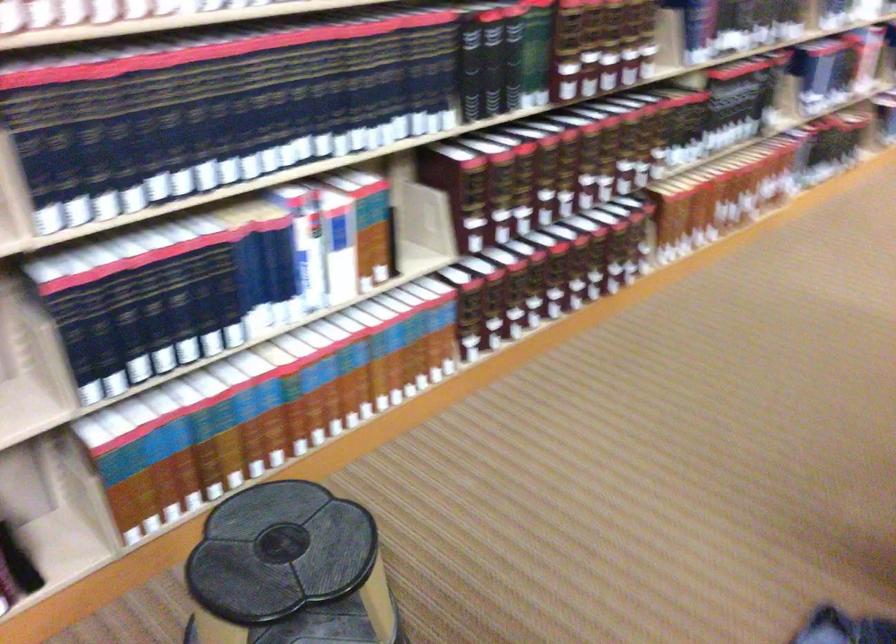
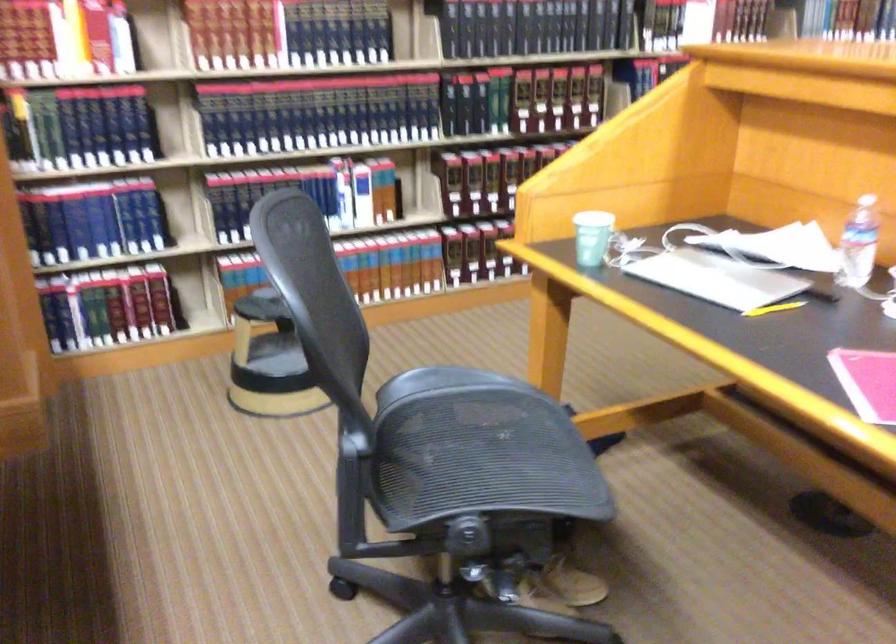
The point at (523, 182) is marked in the first image. Where is the corresponding point in the second image?

(488, 176)